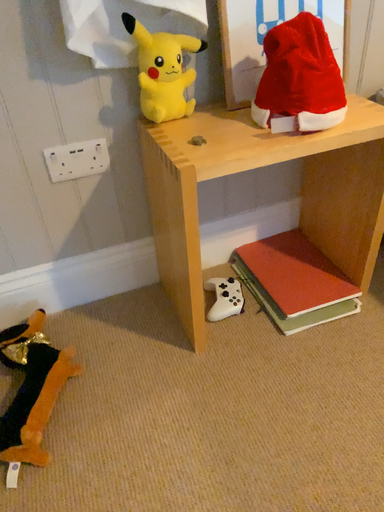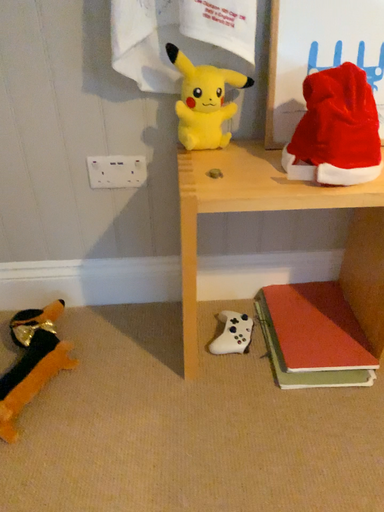
Question: Which way did the camera rotate in the video?

Choices:
 (A) rotated right
 (B) rotated left

Answer: (B)